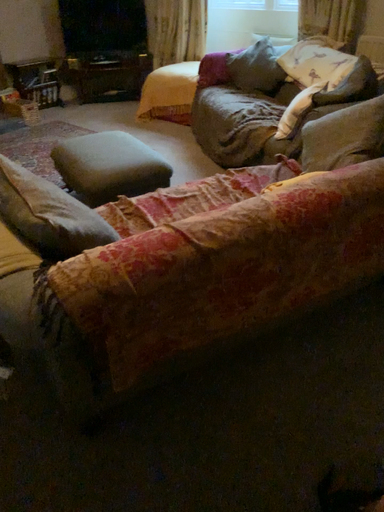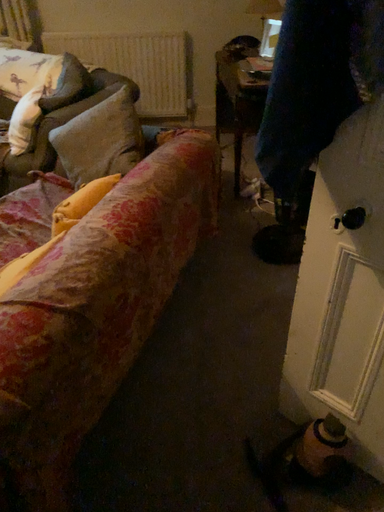
Question: Which way did the camera rotate in the video?

Choices:
 (A) rotated right
 (B) rotated left

Answer: (A)